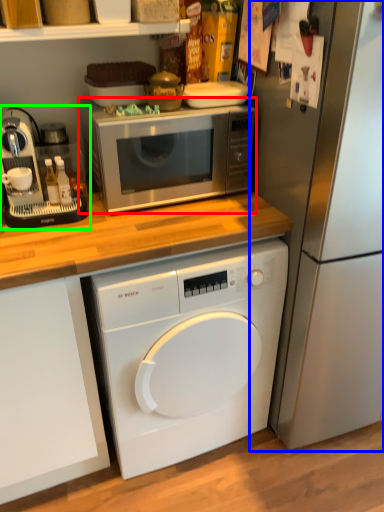
Question: Based on their relative distances, which object is nearer to microwave oven (highlighted by a red box)? Choose from refrigerator (highlighted by a blue box) and coffee machine (highlighted by a green box).

Choices:
 (A) refrigerator
 (B) coffee machine

Answer: (B)